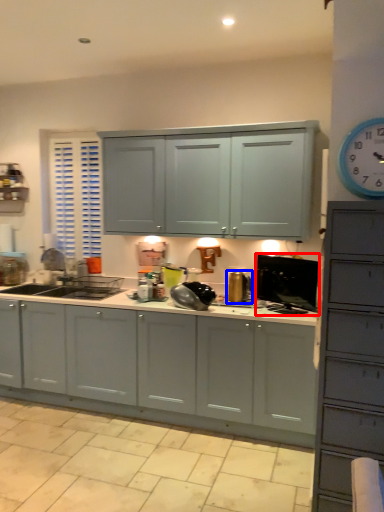
Question: Among these objects, which one is farthest to the camera, appliance (highlighted by a red box) or appliance (highlighted by a blue box)?

Choices:
 (A) appliance
 (B) appliance

Answer: (B)